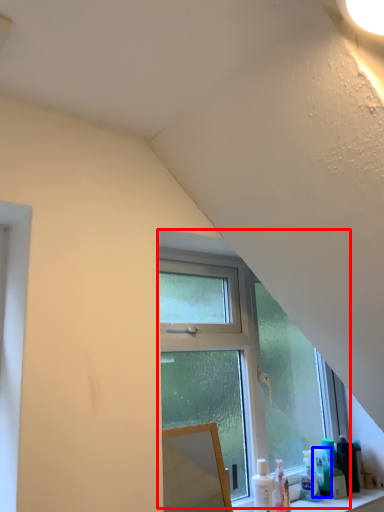
Question: Among these objects, which one is farthest to the camera, window (highlighted by a red box) or toiletry (highlighted by a blue box)?

Choices:
 (A) window
 (B) toiletry

Answer: (B)